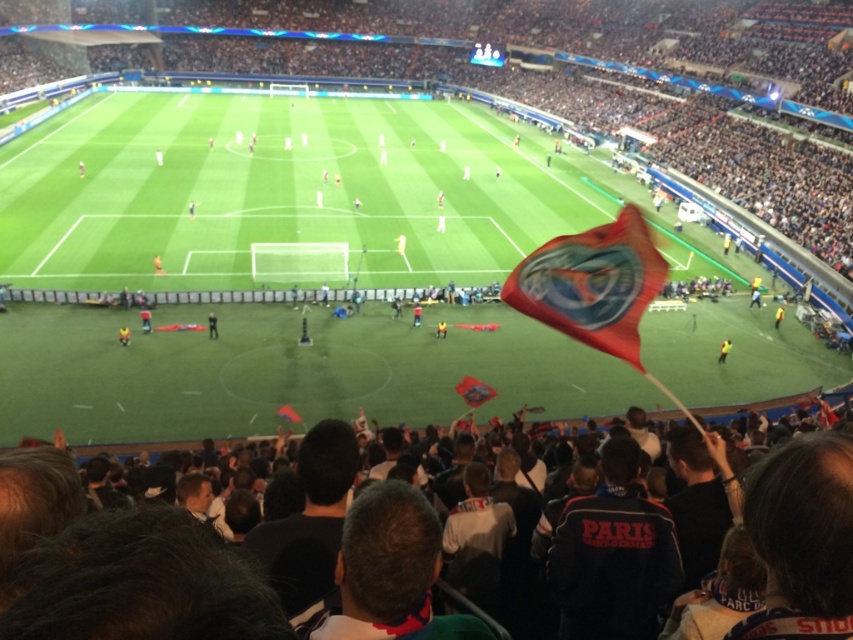
You are a photographer standing at the edge of the soccer field. You want to take a photo that includes both the dark gray fabric crowd at lower center and the yellow fabric flag at center. What is the minimum distance you need to move backward to ensure both are fully visible in your shot?

The dark gray fabric crowd at lower center and yellow fabric flag at center are 84.89 feet apart from each other. To capture both in a single frame, you need to move back until the distance between them fits within your camera lens field of view. However, without knowing the specific focal length and sensor size of your camera, it is impossible to calculate the exact distance. A general rule is to increase distance until both objects are framed appropriately.

In the scene shown: You are a photographer positioned at the camera. You want to capture a photo of the polyester flag at center. Given that your camera has a maximum focus range of 100 feet, will you be able to focus on the flag?

The polyester flag at center and camera are 98.77 feet apart from each other. Since the distance is within the camera maximum focus range of 100 feet, the photographer can focus on the polyester flag at center.

You are a photographer at the soccer stadium. You want to take a photo of the yellow fabric flag at center without the dark gray fabric crowd at lower center blocking it. What should you do?

The dark gray fabric crowd at lower center is in front of the yellow fabric flag at center, so you should move to a position behind the dark gray fabric crowd at lower center to capture the yellow fabric flag at center without obstruction.